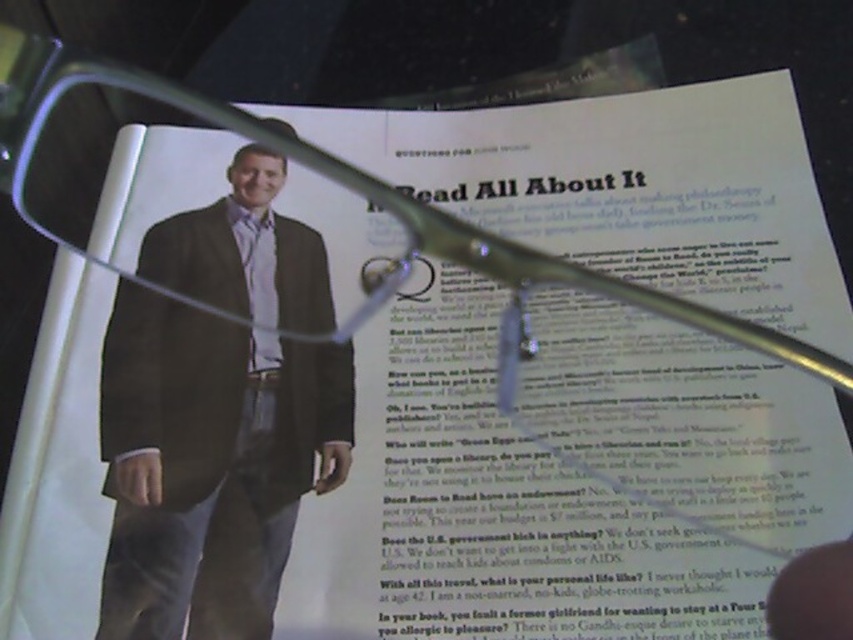
Is matte brown suit at center below matte black tie at center?

Yes, matte brown suit at center is below matte black tie at center.

Who is positioned more to the left, matte brown suit at center or matte black tie at center?

matte brown suit at center is more to the left.

From the picture: Measure the distance between matte brown suit at center and camera.

A distance of 18.79 inches exists between matte brown suit at center and camera.

The image size is (853, 640). Identify the location of matte brown suit at center. (207, 467).